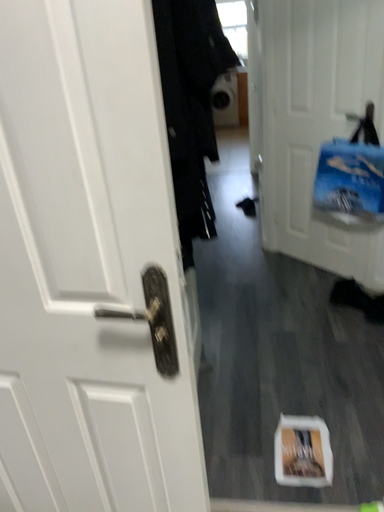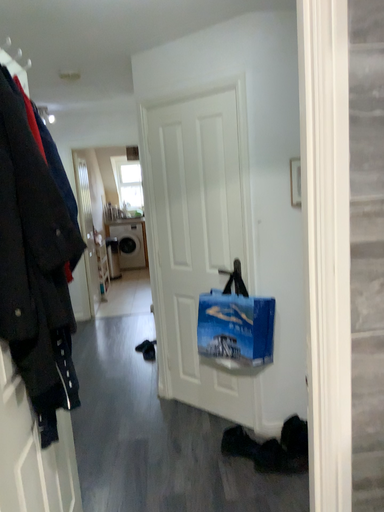
Question: Which way did the camera rotate in the video?

Choices:
 (A) rotated downward
 (B) rotated upward

Answer: (B)